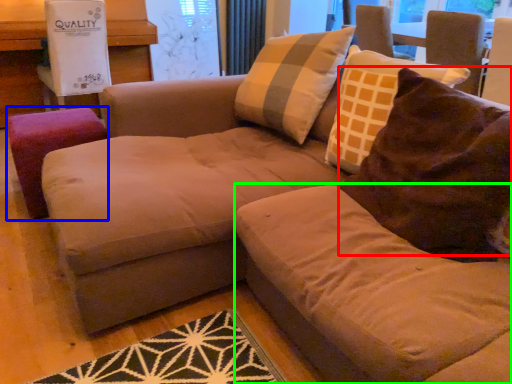
Question: Estimate the real-world distances between objects in this image. Which object is farther from throw pillow (highlighted by a red box), stool (highlighted by a blue box) or beige (highlighted by a green box)?

Choices:
 (A) stool
 (B) beige

Answer: (A)